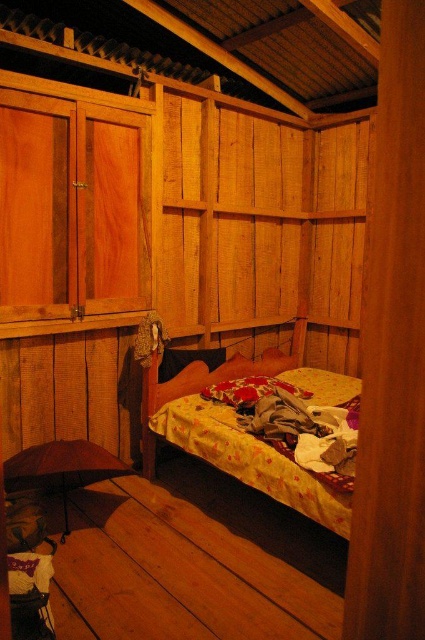
Can you confirm if yellow floral fabric bed at center is positioned to the right of fluffy fabric pillow at center?

Yes, yellow floral fabric bed at center is to the right of fluffy fabric pillow at center.

Find the location of a particular element. The width and height of the screenshot is (425, 640). yellow floral fabric bed at center is located at coordinates (238, 424).

Between yellow floral fabric bed at center and black fabric pillow at center, which one is positioned higher?

black fabric pillow at center

Does point (215, 417) come closer to viewer compared to point (207, 349)?

Yes, it is in front of point (207, 349).

Where is `yellow floral fabric bed at center`? This screenshot has height=640, width=425. yellow floral fabric bed at center is located at coordinates (238, 424).

The width and height of the screenshot is (425, 640). I want to click on fluffy fabric pillow at center, so pos(249,390).

Who is more forward, (229, 385) or (181, 365)?

Point (229, 385)

What do you see at coordinates (249, 390) in the screenshot? I see `fluffy fabric pillow at center` at bounding box center [249, 390].

This screenshot has width=425, height=640. Find the location of `fluffy fabric pillow at center`. fluffy fabric pillow at center is located at coordinates (249, 390).